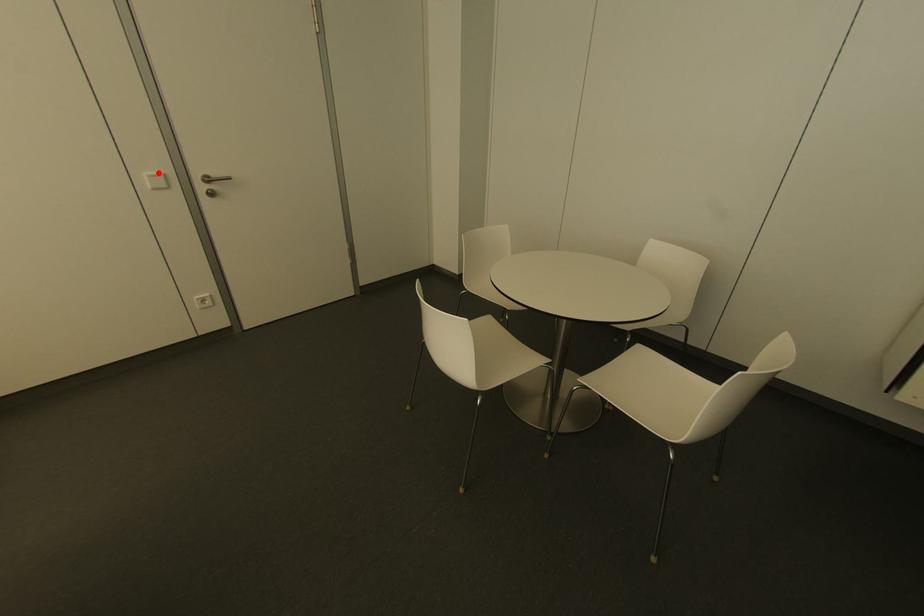
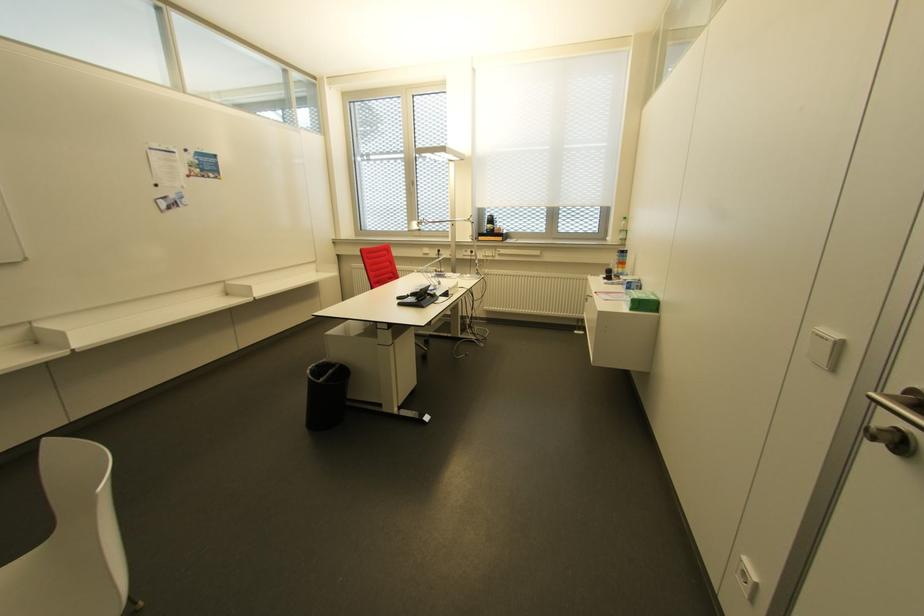
In the second image, find the point that corresponds to the highlighted location in the first image.

(833, 334)